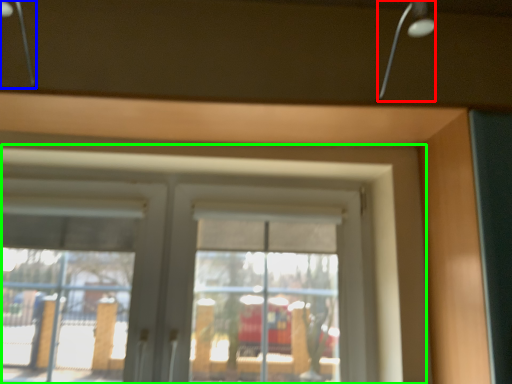
Question: Considering the real-world distances, which object is farthest from lamp (highlighted by a red box)? lamp (highlighted by a blue box) or window (highlighted by a green box)?

Choices:
 (A) lamp
 (B) window

Answer: (A)